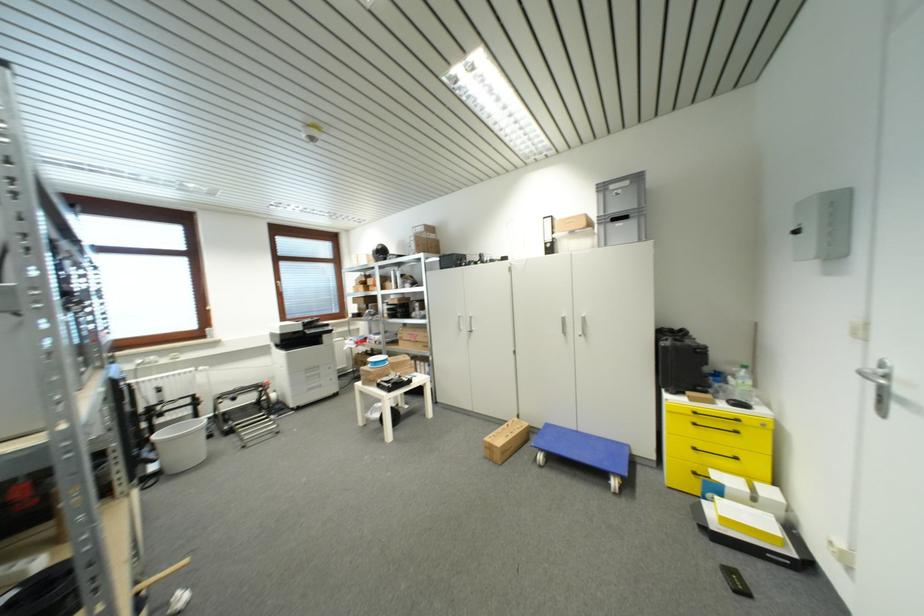
You are a GUI agent. You are given a task and a screenshot of the screen. Output one action in this format:
    pyautogui.click(x=<x>, y=<y>)
    Task: Click on the white bucket
    The width and height of the screenshot is (924, 616).
    Given the screenshot: What is the action you would take?
    pyautogui.click(x=180, y=445)